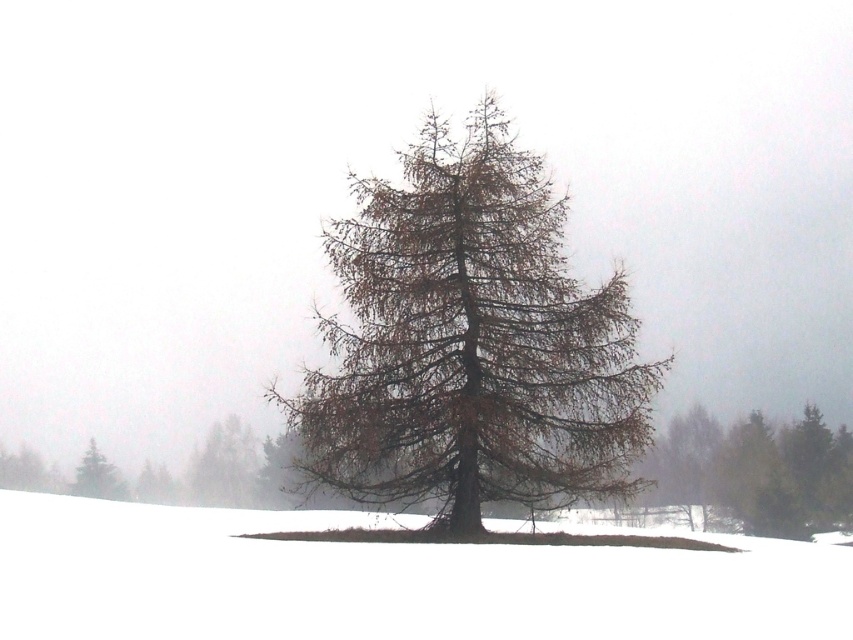
You are standing at the base of the solitary tree in the snowy landscape. You notice two points marked on the image. The first point is at coordinates point (x=648, y=444), and the second is at point (x=97, y=452). Which point is nearer to your current position?

Point (x=648, y=444) is closer to the camera than point (x=97, y=452), so the first point is nearer to your current position.